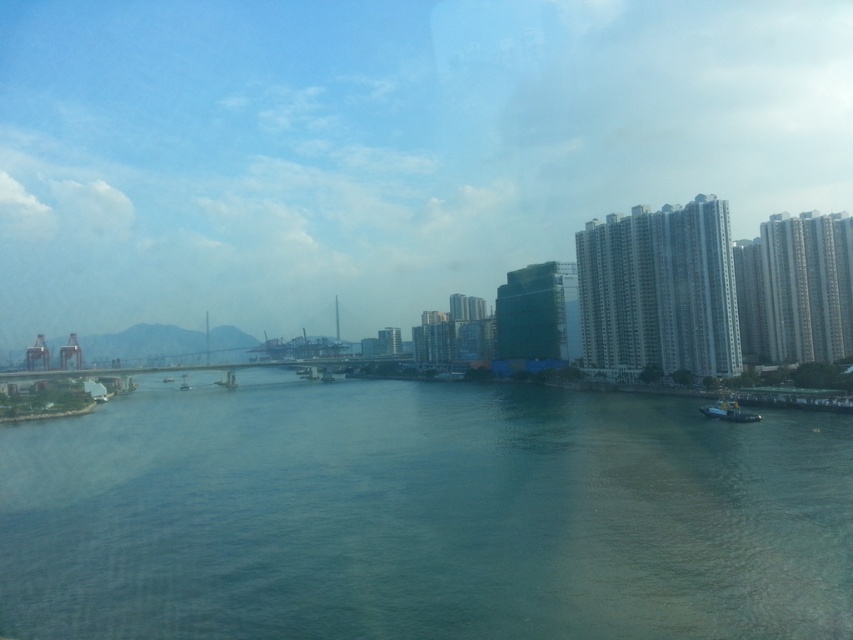
You are standing at the waterfront and want to reach a specific location marked by a point at coordinates point (x=236, y=600). If your maximum walking distance is 100 feet, can you reach it without using any transportation?

The point (x=236, y=600) is 111.23 feet away from the viewer, which exceeds your maximum walking distance of 100 feet. Therefore, you cannot reach it without using transportation.

You are standing at the waterfront and want to take a photo of the two points marked in the scene. Which point, point (41, 435) or point (186, 385), will appear larger in your camera view?

Point (41, 435) will appear larger in the camera view because it is closer to the camera than point (186, 385).